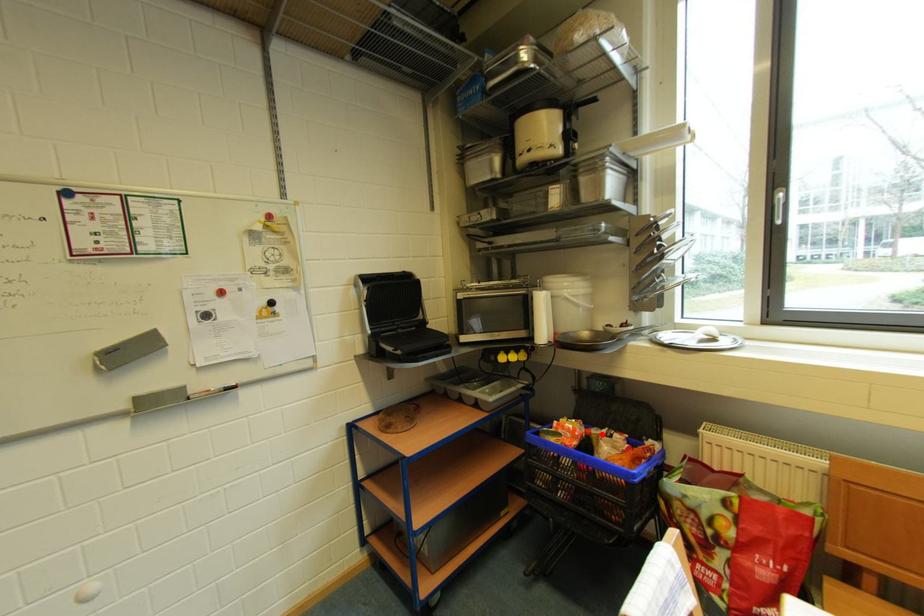
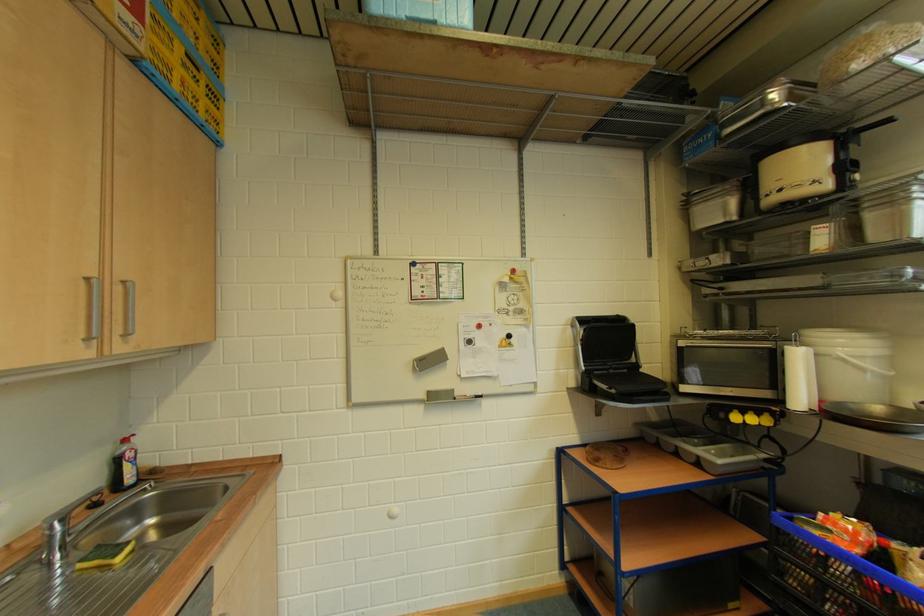
Locate, in the second image, the point that corresponds to the highlighted location in the first image.

(905, 549)